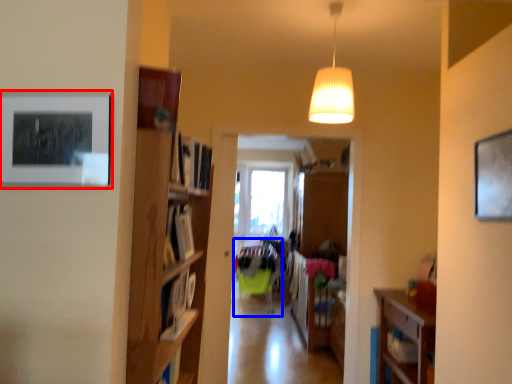
Question: Which point is further to the camera, picture frame (highlighted by a red box) or furniture (highlighted by a blue box)?

Choices:
 (A) picture frame
 (B) furniture

Answer: (B)